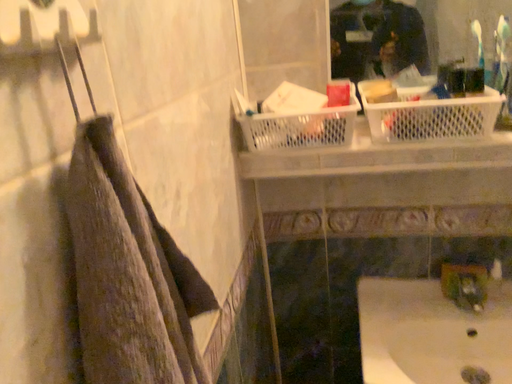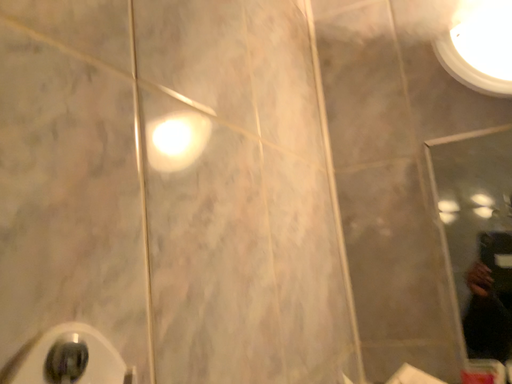
Question: How did the camera likely rotate when shooting the video?

Choices:
 (A) rotated upward
 (B) rotated downward

Answer: (A)